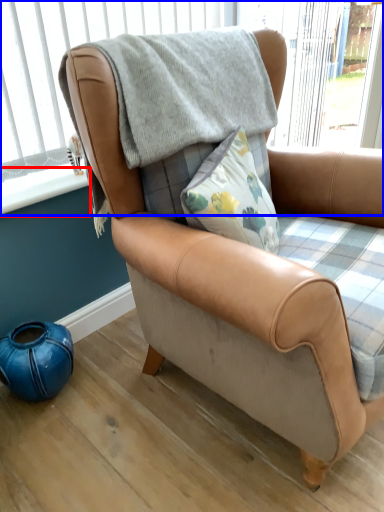
Question: Among these objects, which one is nearest to the camera, window sill (highlighted by a red box) or window frame (highlighted by a blue box)?

Choices:
 (A) window sill
 (B) window frame

Answer: (B)